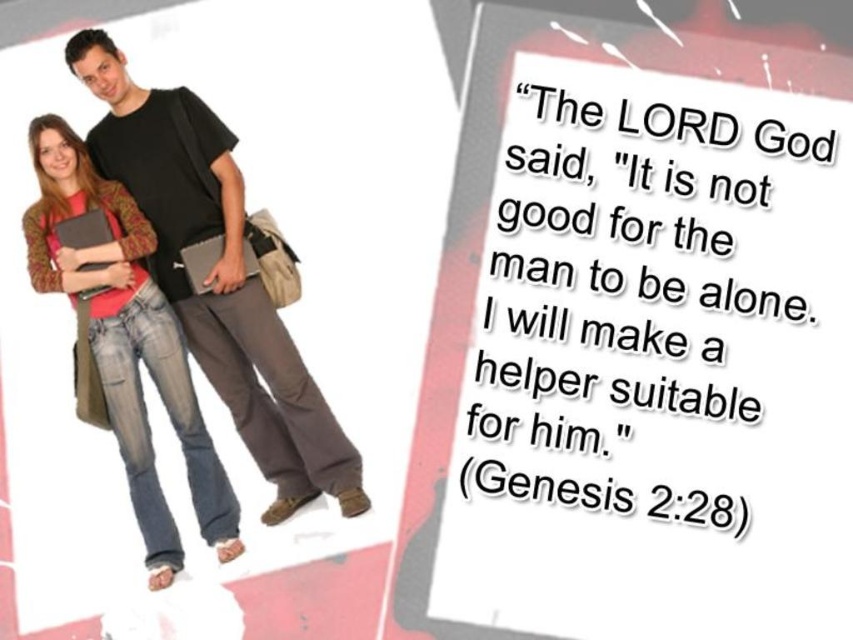
What is the significance of the point at coordinates (216, 276) in the image?

The point at coordinates (216, 276) marks the location of the black matte tshirt at center.

You are a photographer adjusting your camera to focus on two points in the image. The first point is at coordinates point (209, 154) and the second is at point (51, 182). Which point should you focus on first if you want to capture the closest object to the camera?

Point (209, 154) is further to the viewer than point (51, 182), so you should focus on point (51, 182) first as it is closer to the camera.